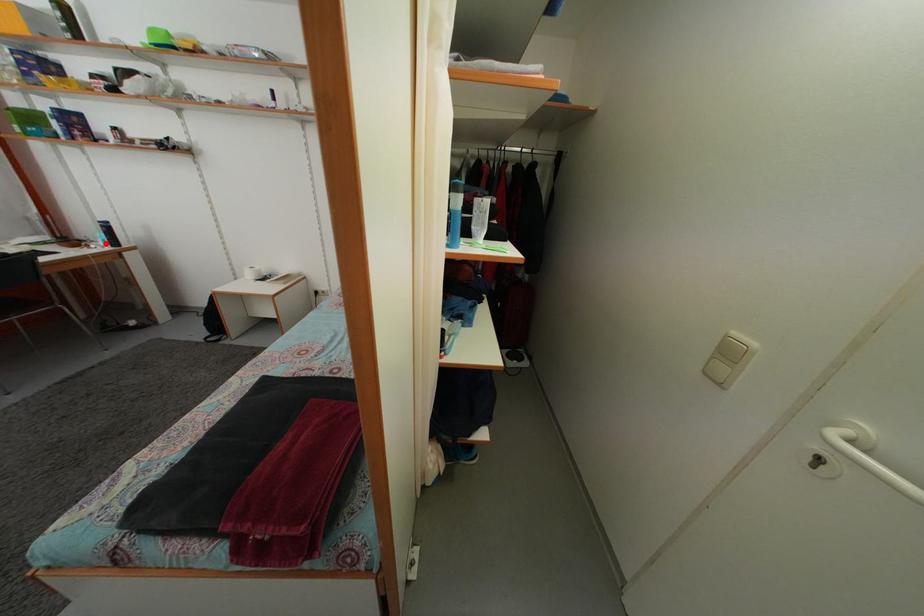
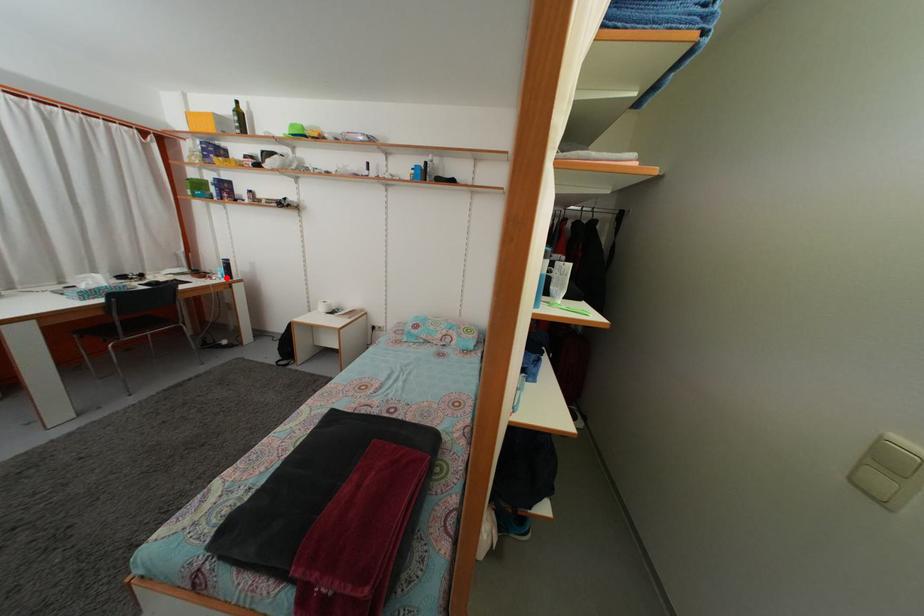
I am providing you with two images of the same scene from different viewpoints. A red point is marked on the first image and another point is marked on the second image. Is the marked point in image1 the same physical position as the marked point in image2?

Yes